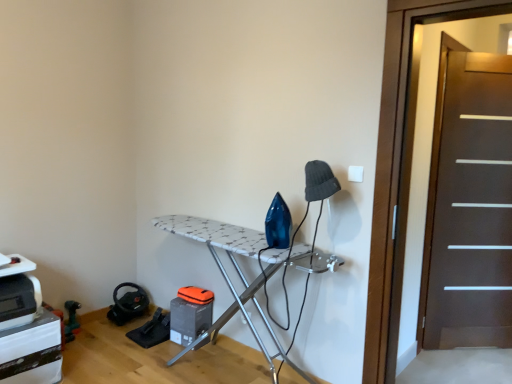
Question: In terms of height, does dark brown wood screen door at right, which is the first screen door from back to front, look taller or shorter compared to white textured ironing board at center?

Choices:
 (A) tall
 (B) short

Answer: (A)

Question: Considering the positions of dark brown wood screen door at right, which is the first screen door from back to front, and white textured ironing board at center in the image, is dark brown wood screen door at right, which is the first screen door from back to front, bigger or smaller than white textured ironing board at center?

Choices:
 (A) small
 (B) big

Answer: (A)

Question: Which object is positioned closest to the white textured ironing board at center?

Choices:
 (A) dark brown wooden screen door at right, acting as the first screen door starting from the front
 (B) dark brown wood screen door at right, which is the first screen door from back to front

Answer: (A)

Question: Estimate the real-world distances between objects in this image. Which object is closer to the dark brown wood screen door at right, positioned as the first screen door in right-to-left order?

Choices:
 (A) white textured ironing board at center
 (B) dark brown wooden screen door at right, acting as the first screen door starting from the front

Answer: (B)